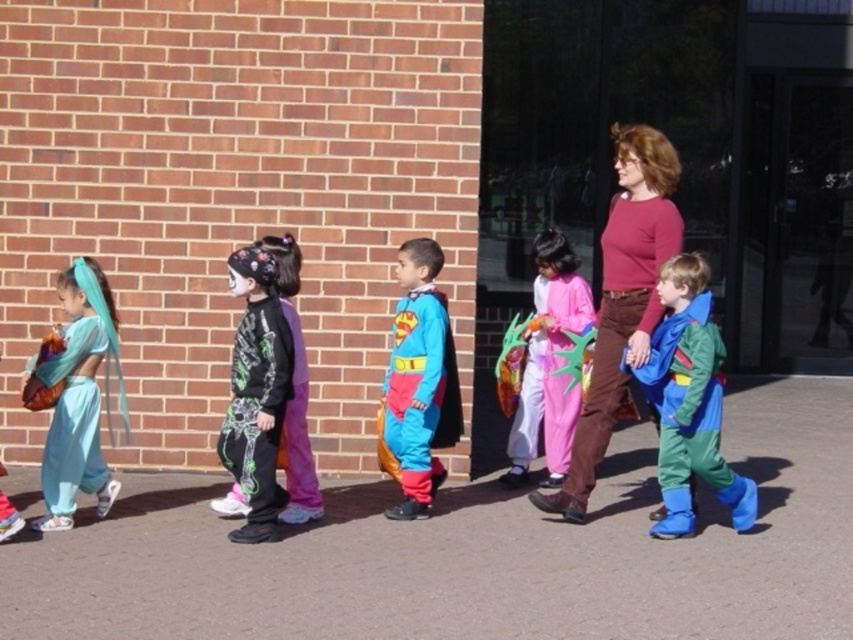
Question: Is matte pink sweater at center to the right of pink fabric costume at center from the viewer's perspective?

Choices:
 (A) yes
 (B) no

Answer: (A)

Question: Which object is closer to the camera taking this photo?

Choices:
 (A) matte pink sweater at center
 (B) brown asphalt at lower center

Answer: (B)

Question: Is superman costume at center smaller than black matte costume at center?

Choices:
 (A) yes
 (B) no

Answer: (B)

Question: Observing the image, what is the correct spatial positioning of matte pink sweater at center in reference to matte teal dress at left?

Choices:
 (A) above
 (B) below

Answer: (A)

Question: Which object appears farthest from the camera in this image?

Choices:
 (A) superman costume at center
 (B) matte blue fabric dress at left
 (C) black matte costume at center
 (D) brown asphalt at lower center

Answer: (A)

Question: Which object appears closest to the camera in this image?

Choices:
 (A) green matte jumpsuit at right
 (B) superman costume at center
 (C) matte teal dress at left

Answer: (C)